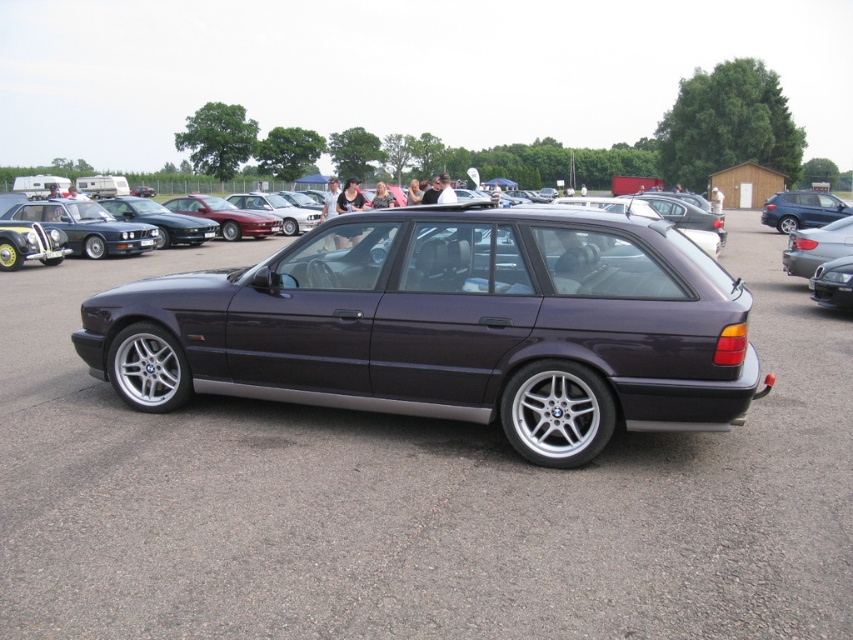
I want to click on metallic gray car at center, so click(415, 499).

Does metallic gray car at center have a lesser width compared to silver metallic rim at lower center?

In fact, metallic gray car at center might be wider than silver metallic rim at lower center.

This screenshot has height=640, width=853. I want to click on metallic gray car at center, so click(415, 499).

Who is more distant from viewer, (x=131, y=385) or (x=817, y=236)?

The point (x=817, y=236) is more distant.

Who is taller, silver metallic rim at lower left or satin silver car at right?

Standing taller between the two is satin silver car at right.

What do you see at coordinates (148, 369) in the screenshot? This screenshot has width=853, height=640. I see `silver metallic rim at lower left` at bounding box center [148, 369].

This screenshot has width=853, height=640. I want to click on silver metallic rim at lower left, so click(x=148, y=369).

Who is taller, silver metallic rim at lower center or satin silver car at right?

satin silver car at right

Can you confirm if silver metallic rim at lower center is positioned to the left of satin silver car at right?

Yes, silver metallic rim at lower center is to the left of satin silver car at right.

At what (x,y) coordinates should I click in order to perform the action: click on silver metallic rim at lower center. Please return your answer as a coordinate pair (x, y). This screenshot has height=640, width=853. Looking at the image, I should click on click(556, 412).